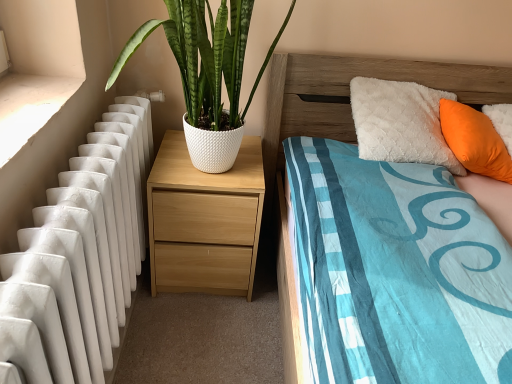
Identify the location of free point in front of light wood/texture nightstand at center. coord(200,337).